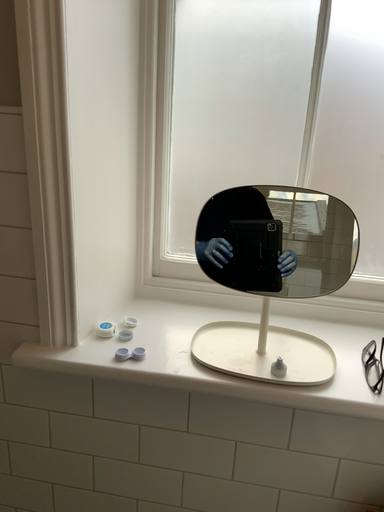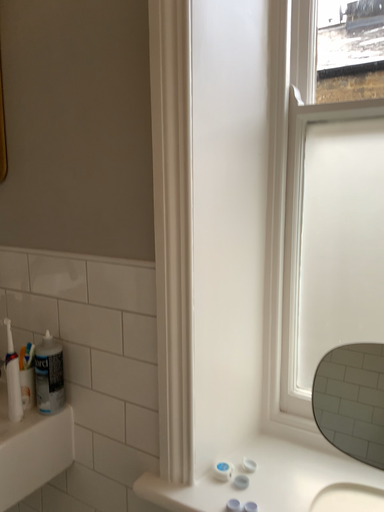
Question: Which way did the camera rotate in the video?

Choices:
 (A) rotated downward
 (B) rotated upward

Answer: (B)